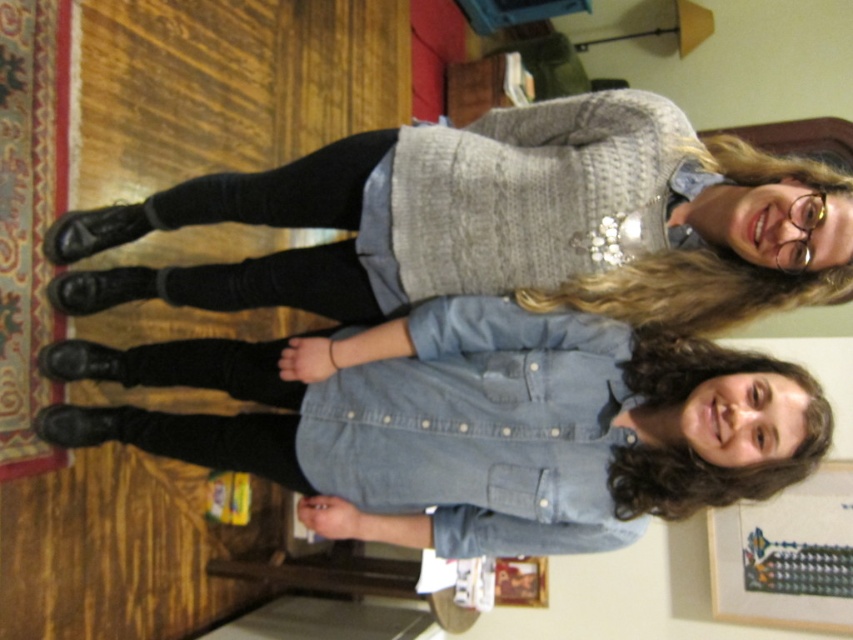
Question: Is denim shirt at center thinner than matte gray sweater at center?

Choices:
 (A) yes
 (B) no

Answer: (A)

Question: Which object is farther from the camera taking this photo?

Choices:
 (A) matte gray sweater at center
 (B) denim shirt at center

Answer: (B)

Question: Which point is closer to the camera?

Choices:
 (A) (138, 435)
 (B) (822, 499)

Answer: (A)

Question: Is denim shirt at center below wooden picture frame at lower right?

Choices:
 (A) yes
 (B) no

Answer: (B)

Question: Which point is closer to the camera?

Choices:
 (A) (788, 540)
 (B) (550, 534)
 (C) (329, 301)

Answer: (B)

Question: Does denim shirt at center come in front of matte gray sweater at center?

Choices:
 (A) no
 (B) yes

Answer: (A)